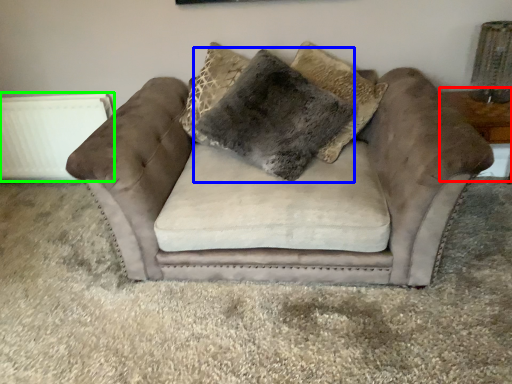
Question: Which object is positioned farthest from table (highlighted by a red box)? Select from pillow (highlighted by a blue box) and radiator (highlighted by a green box).

Choices:
 (A) pillow
 (B) radiator

Answer: (B)